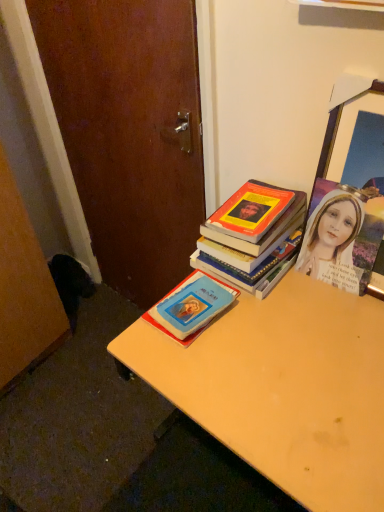
Where is `free spot above light brown wooden desk at center (from a real-world perspective)`? This screenshot has width=384, height=512. free spot above light brown wooden desk at center (from a real-world perspective) is located at coordinates (289, 343).